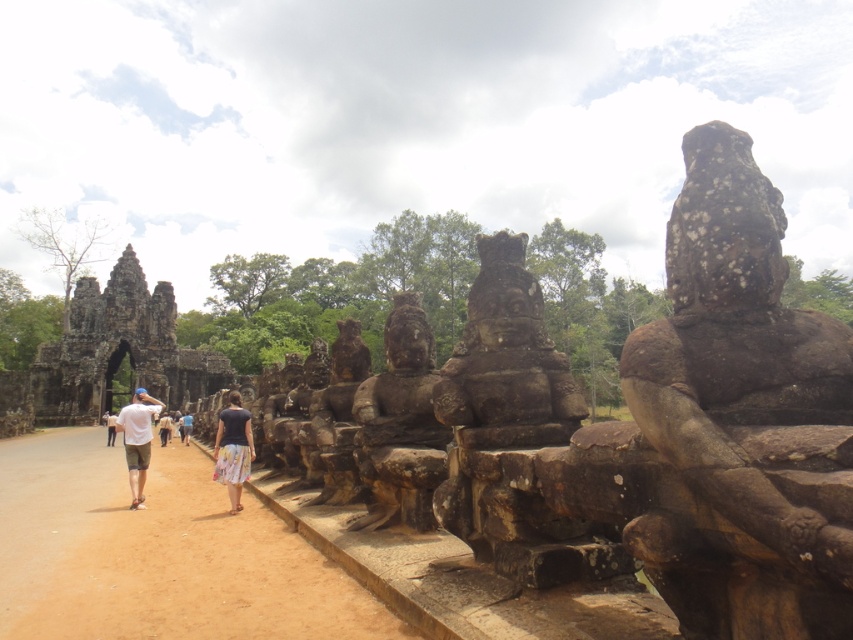
Is brown stone statue at center bigger than light brown fabric dress at center?

Incorrect, brown stone statue at center is not larger than light brown fabric dress at center.

Which is in front, point (402, 310) or point (172, 424)?

Positioned in front is point (402, 310).

Between point (434, 424) and point (189, 417), which one is positioned behind?

The point (189, 417) is more distant.

You are a GUI agent. You are given a task and a screenshot of the screen. Output one action in this format:
    pyautogui.click(x=<x>, y=<y>)
    Task: Click on the brown stone statue at center
    This screenshot has height=640, width=853.
    Given the screenshot: What is the action you would take?
    pyautogui.click(x=399, y=424)

Is rough stone statue at center positioned at the back of brown stone statue at center?

No.

Which is above, rough stone statue at center or brown stone statue at center?

Positioned higher is rough stone statue at center.

Which is in front, point (554, 432) or point (376, 515)?

Positioned in front is point (554, 432).

The height and width of the screenshot is (640, 853). Identify the location of rough stone statue at center. click(506, 360).

Between brown stone statue at center and floral skirt at center, which one is positioned higher?

Positioned higher is brown stone statue at center.

From the picture: Is brown stone statue at center thinner than floral skirt at center?

Yes.

What are the coordinates of `brown stone statue at center` in the screenshot? It's located at (399, 424).

This screenshot has height=640, width=853. I want to click on brown stone statue at center, so click(399, 424).